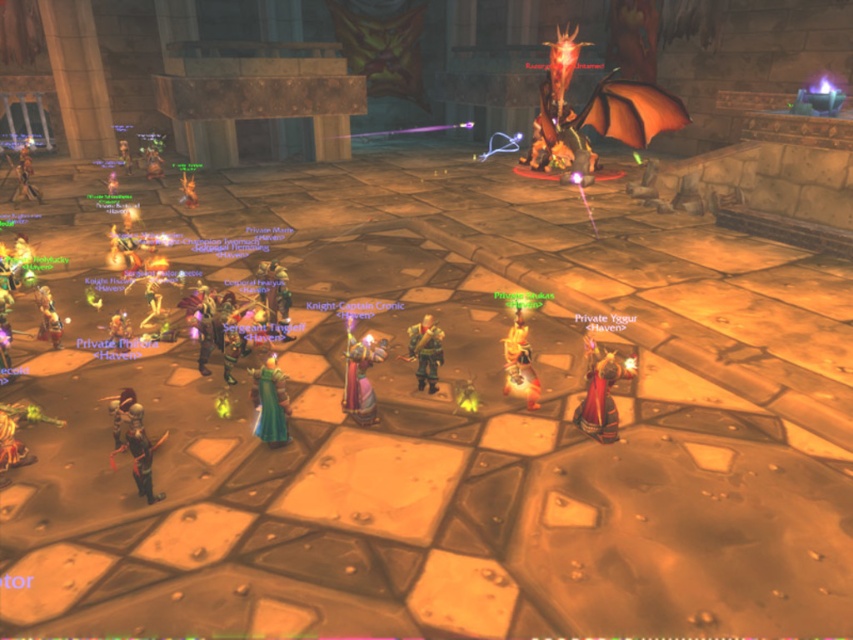
Question: Which object is positioned farthest from the emerald velvet dress at center?

Choices:
 (A) leather armor at lower left
 (B) shiny gold armor at left

Answer: (B)

Question: Does emerald velvet dress at center have a greater width compared to leather armor at lower left?

Choices:
 (A) yes
 (B) no

Answer: (B)

Question: Does red velvet cape at lower right have a smaller size compared to green cloth dress at center?

Choices:
 (A) yes
 (B) no

Answer: (A)

Question: Which point is closer to the camera?

Choices:
 (A) green cloth dress at center
 (B) red velvet cape at lower right

Answer: (B)

Question: Does shiny purple robe at center have a larger size compared to leather armor at lower left?

Choices:
 (A) yes
 (B) no

Answer: (B)

Question: Based on their relative distances, which object is farther from the red velvet cape at lower right?

Choices:
 (A) green cloth dress at center
 (B) shiny gold armor at left

Answer: (A)